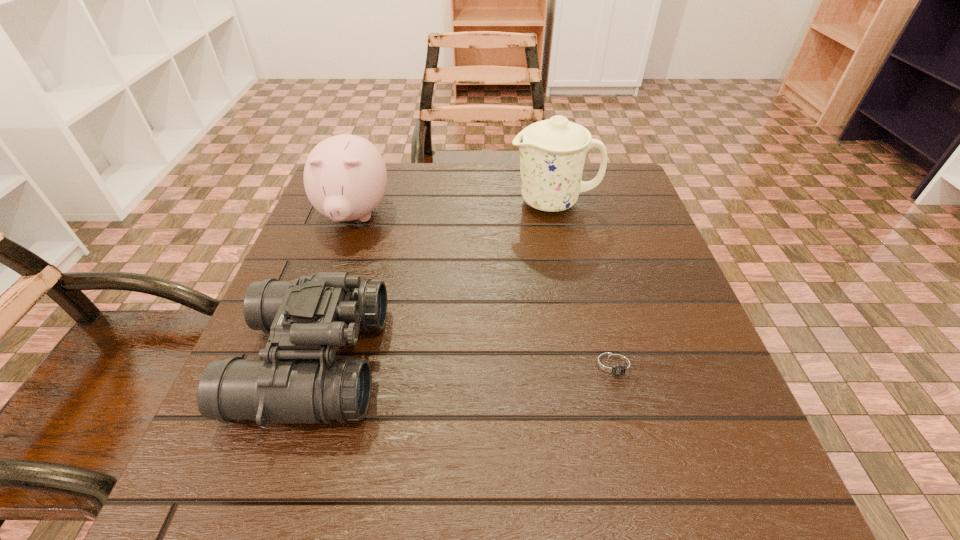
The height and width of the screenshot is (540, 960). Find the location of `chinaware`. chinaware is located at coordinates (552, 152).

Locate an element on the screen. piggy bank is located at coordinates (345, 177).

Where is `binoculars`? This screenshot has height=540, width=960. binoculars is located at coordinates (298, 379).

Identify the location of the shortest object. (615, 366).

Locate an element on the screen. The image size is (960, 540). free space located on the spout of the chinaware is located at coordinates (377, 202).

Where is `vacant space located on the spout of the chinaware`? This screenshot has width=960, height=540. vacant space located on the spout of the chinaware is located at coordinates (472, 202).

Where is `free point located 0.280m on the spout of the chinaware`? free point located 0.280m on the spout of the chinaware is located at coordinates click(x=394, y=202).

Identify the location of free space located at the snout of the third shortest object. Image resolution: width=960 pixels, height=540 pixels. (324, 302).

Locate an element on the screen. This screenshot has height=540, width=960. vacant space located 0.360m through the lenses of the binoculars is located at coordinates (595, 361).

In order to click on vacant space located on the face of the watch in this screenshot , I will do `click(634, 433)`.